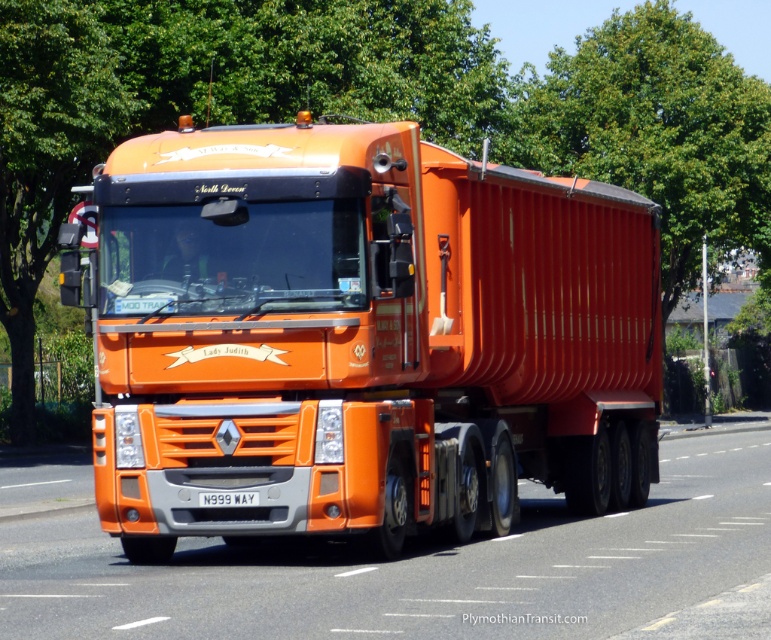
The image size is (771, 640). Find the location of `orange glossy truck at center`. orange glossy truck at center is located at coordinates (419, 570).

Who is more forward, (426, 602) or (234, 502)?

Point (426, 602) is more forward.

Locate an element on the screen. orange glossy truck at center is located at coordinates [419, 570].

Is orange matte trailer truck at center shorter than orange glossy truck at center?

No.

What do you see at coordinates (362, 337) in the screenshot? I see `orange matte trailer truck at center` at bounding box center [362, 337].

Who is more distant from viewer, (618, 500) or (655, 609)?

The point (618, 500) is behind.

This screenshot has height=640, width=771. What are the coordinates of `orange matte trailer truck at center` in the screenshot? It's located at (362, 337).

Is orange matte trailer truck at center positioned in front of white plastic license plate at center?

Yes, orange matte trailer truck at center is in front of white plastic license plate at center.

Is point (152, 476) less distant than point (207, 500)?

No, it is behind (207, 500).

Which is in front, point (300, 243) or point (244, 496)?

Point (244, 496) is more forward.

The width and height of the screenshot is (771, 640). Find the location of `orange matte trailer truck at center`. orange matte trailer truck at center is located at coordinates (362, 337).